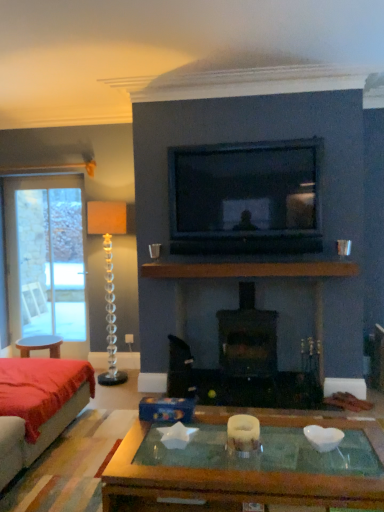
Based on the photo, what is the approximate height of black matte fireplace at center?

black matte fireplace at center is 37.87 inches tall.

The height and width of the screenshot is (512, 384). What do you see at coordinates (245, 198) in the screenshot? I see `matte black television at upper center` at bounding box center [245, 198].

Describe the element at coordinates (243, 435) in the screenshot. I see `white frosted glass candle holder at center, placed as the 1th candle holder when sorted from bottom to top` at that location.

Find the location of `white frosted glass candle holder at center, marked as the first candle holder in a front-to-back arrangement`. white frosted glass candle holder at center, marked as the first candle holder in a front-to-back arrangement is located at coordinates (243, 435).

Find the location of `velvet red couch at lower left`. velvet red couch at lower left is located at coordinates (40, 417).

The image size is (384, 512). What do you see at coordinates (109, 275) in the screenshot?
I see `clear glass candle holder at left, which is counted as the 2th candle holder, starting from the right` at bounding box center [109, 275].

Where is `clear glass screen door at left`? clear glass screen door at left is located at coordinates (46, 260).

Where is `silver metallic cup at center`? This screenshot has width=384, height=512. silver metallic cup at center is located at coordinates (154, 250).

What's the angular difference between silver metallic cup at center and black matte fireplace at center's facing directions?

2.23 degrees separate the facing orientations of silver metallic cup at center and black matte fireplace at center.

How far apart are silver metallic cup at center and black matte fireplace at center?

A distance of 1.14 meters exists between silver metallic cup at center and black matte fireplace at center.

Which is behind, silver metallic cup at center or black matte fireplace at center?

black matte fireplace at center.

Could you tell me if silver metallic cup at center is turned towards black matte fireplace at center?

No, silver metallic cup at center is not oriented towards black matte fireplace at center.

From a real-world perspective, is white frosted glass candle holder at center, which appears as the first candle holder when viewed from the right, under clear glass candle holder at left, the 1th candle holder in the left-to-right sequence?

Correct, in the physical world, white frosted glass candle holder at center, which appears as the first candle holder when viewed from the right, is lower than clear glass candle holder at left, the 1th candle holder in the left-to-right sequence.

Consider the image. Which is correct: white frosted glass candle holder at center, which appears as the first candle holder when viewed from the right, is inside clear glass candle holder at left, which is counted as the 2th candle holder, starting from the right, or outside of it?

white frosted glass candle holder at center, which appears as the first candle holder when viewed from the right, exists outside the volume of clear glass candle holder at left, which is counted as the 2th candle holder, starting from the right.

Which is nearer, (245, 440) or (109, 304)?

Clearly, point (245, 440) is closer to the camera than point (109, 304).

Is point (178, 246) positioned in front of point (49, 214)?

Yes, it is.

From the picture: Can you confirm if matte black television at upper center is taller than clear glass screen door at left?

No.

Is matte black television at upper center not close to clear glass screen door at left?

matte black television at upper center is far away from clear glass screen door at left.

From the image's perspective, would you say matte black television at upper center is positioned over clear glass screen door at left?

Yes, from the image's perspective, matte black television at upper center is on top of clear glass screen door at left.

Who is smaller, silver metallic cup at center or brown wooden mantle at center?

silver metallic cup at center.

Which object is more forward, silver metallic cup at center or brown wooden mantle at center?

brown wooden mantle at center is in front.

Between silver metallic cup at center and brown wooden mantle at center, which one appears on the left side from the viewer's perspective?

silver metallic cup at center is more to the left.

What are the coordinates of `coffee cup lying behind the brown wooden mantle at center` in the screenshot? It's located at (154, 250).

Is white frosted glass candle holder at center, which is the second candle holder in back-to-front order, at the back of brown wooden mantle at center?

No, white frosted glass candle holder at center, which is the second candle holder in back-to-front order, is not at the back of brown wooden mantle at center.

Based on the photo, from a real-world perspective, relative to white frosted glass candle holder at center, marked as the first candle holder in a front-to-back arrangement, is brown wooden mantle at center vertically above or below?

Clearly, from a real-world perspective, brown wooden mantle at center is above white frosted glass candle holder at center, marked as the first candle holder in a front-to-back arrangement.

Considering the relative sizes of brown wooden mantle at center and white frosted glass candle holder at center, arranged as the second candle holder when viewed from the top, in the image provided, is brown wooden mantle at center smaller than white frosted glass candle holder at center, arranged as the second candle holder when viewed from the top,?

No, brown wooden mantle at center is not smaller than white frosted glass candle holder at center, arranged as the second candle holder when viewed from the top.

Between brown wooden mantle at center and white frosted glass candle holder at center, marked as the first candle holder in a front-to-back arrangement, which one appears on the right side from the viewer's perspective?

brown wooden mantle at center.

Considering the relative positions of black matte fireplace at center and white frosted glass candle holder at center, the second candle holder in the left-to-right sequence, in the image provided, is black matte fireplace at center to the left of white frosted glass candle holder at center, the second candle holder in the left-to-right sequence, from the viewer's perspective?

No, black matte fireplace at center is not to the left of white frosted glass candle holder at center, the second candle holder in the left-to-right sequence.

Does black matte fireplace at center have a lesser width compared to white frosted glass candle holder at center, which appears as the first candle holder when viewed from the right?

No, black matte fireplace at center is not thinner than white frosted glass candle holder at center, which appears as the first candle holder when viewed from the right.

Considering the sizes of black matte fireplace at center and white frosted glass candle holder at center, placed as the 1th candle holder when sorted from bottom to top, in the image, is black matte fireplace at center bigger or smaller than white frosted glass candle holder at center, placed as the 1th candle holder when sorted from bottom to top,?

In the image, black matte fireplace at center appears to be larger than white frosted glass candle holder at center, placed as the 1th candle holder when sorted from bottom to top.

Is the surface of black matte fireplace at center in direct contact with brown wooden mantle at center?

No, black matte fireplace at center is not in contact with brown wooden mantle at center.

Is black matte fireplace at center shorter than brown wooden mantle at center?

Incorrect, the height of black matte fireplace at center does not fall short of that of brown wooden mantle at center.

Is black matte fireplace at center at the left side of brown wooden mantle at center?

No, black matte fireplace at center is not to the left of brown wooden mantle at center.

How different are the orientations of black matte fireplace at center and brown wooden mantle at center in degrees?

The angle between the facing direction of black matte fireplace at center and the facing direction of brown wooden mantle at center is 0.101 degrees.

Find the location of a particular element. The image size is (384, 512). fireplace behind the silver metallic cup at center is located at coordinates (247, 338).

Image resolution: width=384 pixels, height=512 pixels. Find the location of `candle holder lying above the white frosted glass candle holder at center, which is the second candle holder in back-to-front order (from the image's perspective)`. candle holder lying above the white frosted glass candle holder at center, which is the second candle holder in back-to-front order (from the image's perspective) is located at coordinates (109, 275).

Estimate the real-world distances between objects in this image. Which object is closer to clear glass candle holder at left, the 2th candle holder positioned from the front, clear glass screen door at left or brown wooden mantle at center?

brown wooden mantle at center is positioned closer to the anchor clear glass candle holder at left, the 2th candle holder positioned from the front.

Looking at the image, which one is located closer to matte black television at upper center, velvet red couch at lower left or silver metallic cup at center?

silver metallic cup at center lies closer to matte black television at upper center than the other object.

Based on the photo, when comparing their distances from white frosted glass candle holder at center, the second candle holder in the left-to-right sequence, does black matte fireplace at center or matte black television at upper center seem closer?

Based on the image, black matte fireplace at center appears to be nearer to white frosted glass candle holder at center, the second candle holder in the left-to-right sequence.

Which object lies nearer to the anchor point brown wooden mantle at center, clear glass screen door at left or matte black television at upper center?

matte black television at upper center lies closer to brown wooden mantle at center than the other object.

Considering their positions, is velvet red couch at lower left positioned closer to white frosted glass candle holder at center, placed as the 1th candle holder when sorted from bottom to top, than matte black television at upper center?

Among the two, velvet red couch at lower left is located nearer to white frosted glass candle holder at center, placed as the 1th candle holder when sorted from bottom to top.

Considering their positions, is silver metallic cup at center positioned further to white frosted glass candle holder at center, arranged as the second candle holder when viewed from the top, than black matte fireplace at center?

Based on the image, silver metallic cup at center appears to be further to white frosted glass candle holder at center, arranged as the second candle holder when viewed from the top.

Considering their positions, is black matte fireplace at center positioned closer to matte black television at upper center than white frosted glass candle holder at center, the second candle holder in the left-to-right sequence?

The object closer to matte black television at upper center is black matte fireplace at center.

When comparing their distances from clear glass candle holder at left, which is counted as the 2th candle holder, starting from the right, does clear glass screen door at left or black matte fireplace at center seem closer?

clear glass screen door at left is closer to clear glass candle holder at left, which is counted as the 2th candle holder, starting from the right.

Image resolution: width=384 pixels, height=512 pixels. Find the location of `fireplace positioned between white frosted glass candle holder at center, the second candle holder in the left-to-right sequence, and clear glass candle holder at left, the second candle holder when ordered from bottom to top, from near to far`. fireplace positioned between white frosted glass candle holder at center, the second candle holder in the left-to-right sequence, and clear glass candle holder at left, the second candle holder when ordered from bottom to top, from near to far is located at coordinates (247, 338).

Where is `fireplace between white frosted glass candle holder at center, marked as the first candle holder in a front-to-back arrangement, and clear glass screen door at left in the front-back direction`? fireplace between white frosted glass candle holder at center, marked as the first candle holder in a front-to-back arrangement, and clear glass screen door at left in the front-back direction is located at coordinates (247, 338).

Find the location of a particular element. Image resolution: width=384 pixels, height=512 pixels. studio couch between clear glass screen door at left and matte black television at upper center in the horizontal direction is located at coordinates (40, 417).

The width and height of the screenshot is (384, 512). I want to click on television between white frosted glass candle holder at center, which is the second candle holder in back-to-front order, and silver metallic cup at center from front to back, so click(x=245, y=198).